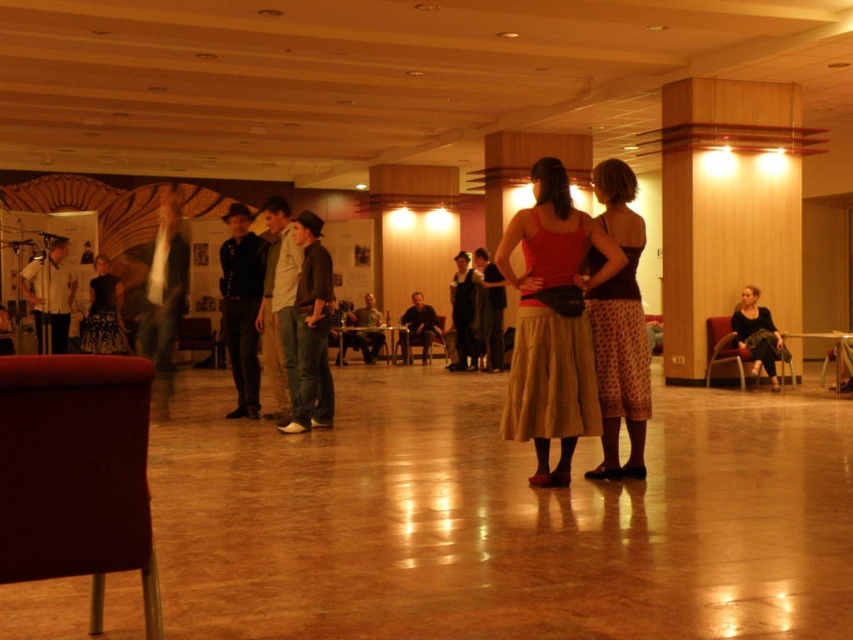
Who is higher up, dark brown leather jacket at center or matte gray jacket at center?

dark brown leather jacket at center is above.

Is dark brown leather jacket at center above matte gray jacket at center?

Yes.

Where is `dark brown leather jacket at center`? The width and height of the screenshot is (853, 640). dark brown leather jacket at center is located at coordinates (463, 314).

Which is in front, point (51, 248) or point (471, 355)?

Point (51, 248) is more forward.

Locate an element on the screen. This screenshot has height=640, width=853. white shirt at left is located at coordinates (49, 296).

Can you confirm if dark brown leather jacket at lower right is shorter than matte black jacket at center?

Yes.

Consider the image. Which is more to the left, dark brown leather jacket at lower right or matte black jacket at center?

From the viewer's perspective, matte black jacket at center appears more on the left side.

What do you see at coordinates (758, 336) in the screenshot? I see `dark brown leather jacket at lower right` at bounding box center [758, 336].

Locate an element on the screen. The image size is (853, 640). dark brown leather jacket at lower right is located at coordinates (758, 336).